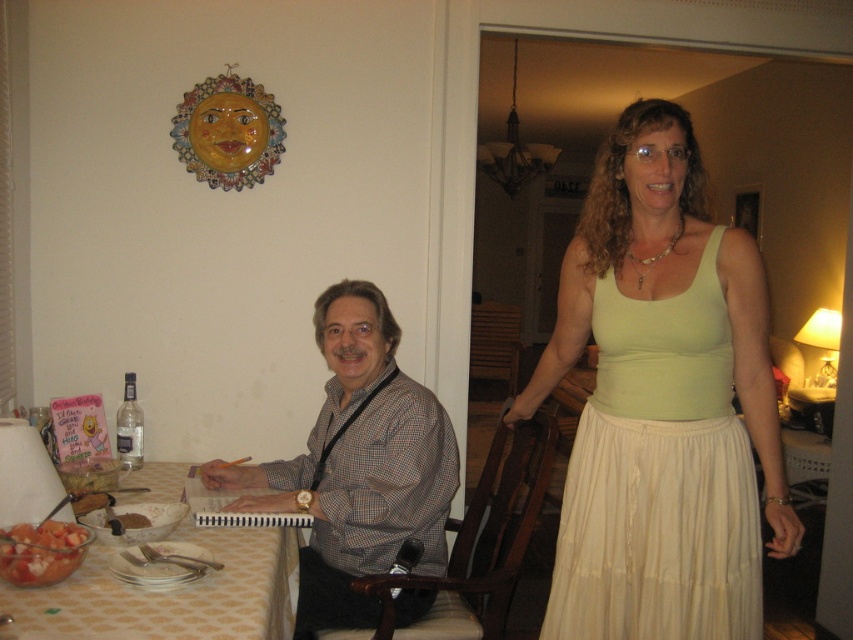
You are a guest at this dining area and want to place your phone on the table. The patterned fabric table at lower left and the tomato salad at table left are already on the table. Where should you place your phone to ensure it doesn not fall off the table?

Place your phone on the patterned fabric table at lower left since it is the table surface and the tomato salad at table left is placed on top of it, so the salad might not provide a stable surface.

You are a guest at this dining table and want to place your phone on the table without disturbing the checkered fabric shirt at center or the tomato salad at table left. Where should you place it?

You should place your phone on the table in an area not occupied by the checkered fabric shirt at center or the tomato salad at table left, ensuring it doesn not interfere with either. Since the checkered fabric shirt at center is above the tomato salad at table left, placing it below the salad or to the side might work.